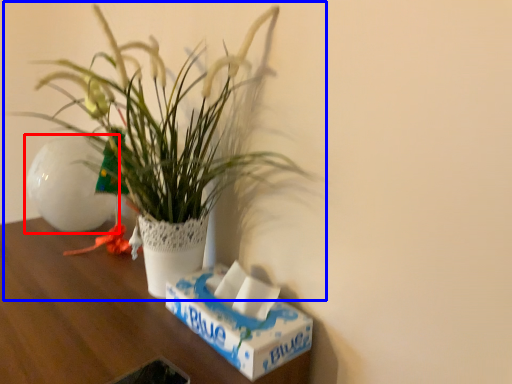
Question: Which object is closer to the camera taking this photo, flowerpot (highlighted by a red box) or houseplant (highlighted by a blue box)?

Choices:
 (A) flowerpot
 (B) houseplant

Answer: (B)